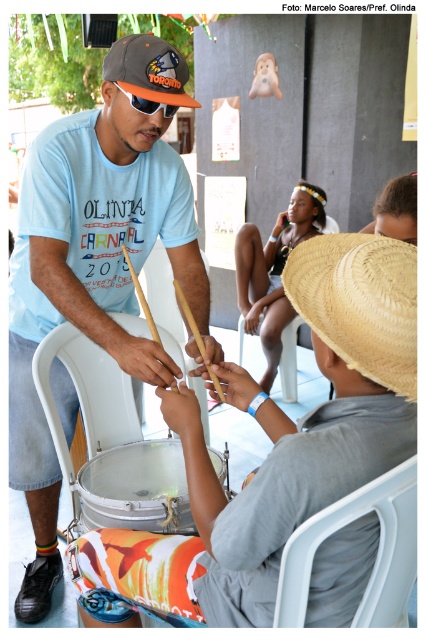
You are a photographer trying to capture a closeup shot of both the natural straw hat at center and the light brown skin at center. Since you want both to be clearly visible in the photo, which object should you focus on to ensure it doesn t get too small in the frame?

The natural straw hat at center has a smaller size compared to light brown skin at center, so you should focus on the natural straw hat at center to ensure it doesn t get too small in the frame.

You are a photographer standing at the scene. You want to take a closeup of the natural straw hat at center without moving the camera. What adjustment should you make to the lens?

Since the natural straw hat at center is 31.65 inches away from the camera, you should adjust the lens to zoom in to capture a closeup without moving the camera position.